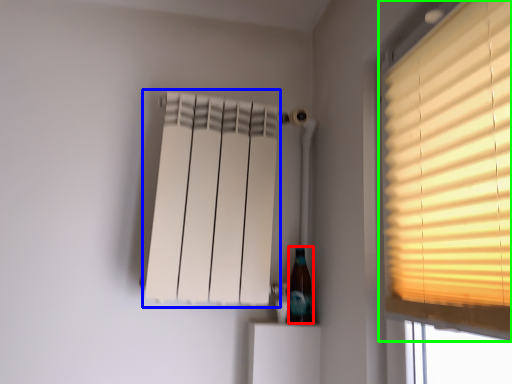
Question: Which object is positioned closest to bottle (highlighted by a red box)? Select from curtain (highlighted by a blue box) and window (highlighted by a green box).

Choices:
 (A) curtain
 (B) window

Answer: (A)